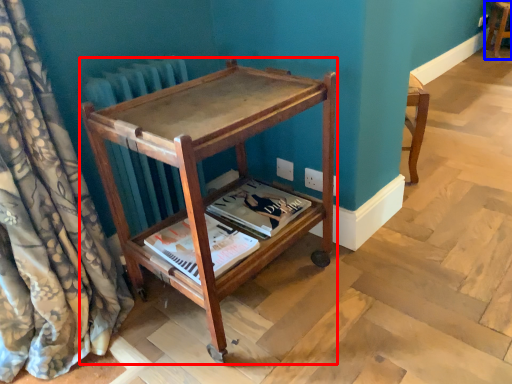
Question: Which object is further to the camera taking this photo, furniture (highlighted by a red box) or furniture (highlighted by a blue box)?

Choices:
 (A) furniture
 (B) furniture

Answer: (B)